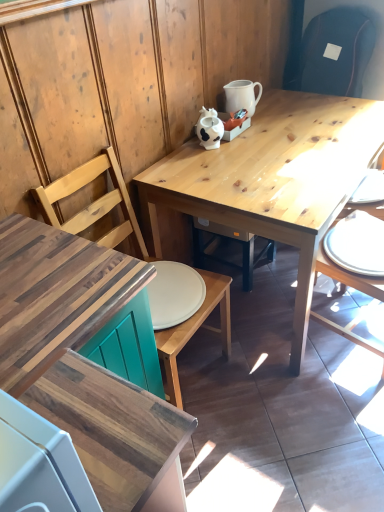
Question: Is wooden chair at right, the first chair viewed from the right, positioned behind white glossy plate at right?

Choices:
 (A) no
 (B) yes

Answer: (A)

Question: From the image's perspective, does wooden chair at right, which is the 2th chair in left-to-right order, appear higher than white glossy plate at right?

Choices:
 (A) yes
 (B) no

Answer: (B)

Question: Can white glossy plate at right be found inside wooden chair at right, which is the 2th chair in left-to-right order?

Choices:
 (A) yes
 (B) no

Answer: (A)

Question: Is wooden chair at right, the first chair viewed from the right, next to white glossy plate at right?

Choices:
 (A) yes
 (B) no

Answer: (B)

Question: Is the position of wooden chair at right, which is the 2th chair in left-to-right order, less distant than that of white glossy plate at right?

Choices:
 (A) yes
 (B) no

Answer: (A)

Question: From their relative heights in the image, would you say wooden desk at lower left is taller or shorter than white glossy plate at right?

Choices:
 (A) short
 (B) tall

Answer: (B)

Question: Considering the relative positions of wooden desk at lower left and white glossy plate at right in the image provided, is wooden desk at lower left to the left or to the right of white glossy plate at right?

Choices:
 (A) left
 (B) right

Answer: (A)

Question: Considering the positions of wooden desk at lower left and white glossy plate at right in the image, is wooden desk at lower left bigger or smaller than white glossy plate at right?

Choices:
 (A) big
 (B) small

Answer: (A)

Question: From a real-world perspective, relative to white glossy plate at right, is wooden desk at lower left vertically above or below?

Choices:
 (A) below
 (B) above

Answer: (B)

Question: Would you say wooden chair at center, acting as the 2th chair starting from the right, is to the left or to the right of white glossy pitcher at upper center in the picture?

Choices:
 (A) left
 (B) right

Answer: (A)

Question: Is point [162, 358] positioned closer to the camera than point [243, 84]?

Choices:
 (A) closer
 (B) farther

Answer: (A)

Question: In the image, is wooden chair at center, acting as the 2th chair starting from the right, positioned in front of or behind white glossy pitcher at upper center?

Choices:
 (A) front
 (B) behind

Answer: (A)

Question: Is wooden chair at center, the first chair viewed from the left, taller or shorter than white glossy pitcher at upper center?

Choices:
 (A) tall
 (B) short

Answer: (A)

Question: From their relative heights in the image, would you say wooden chair at center, acting as the 2th chair starting from the right, is taller or shorter than white glossy plate at right?

Choices:
 (A) short
 (B) tall

Answer: (B)

Question: Relative to white glossy plate at right, is wooden chair at center, acting as the 2th chair starting from the right, in front or behind?

Choices:
 (A) behind
 (B) front

Answer: (B)